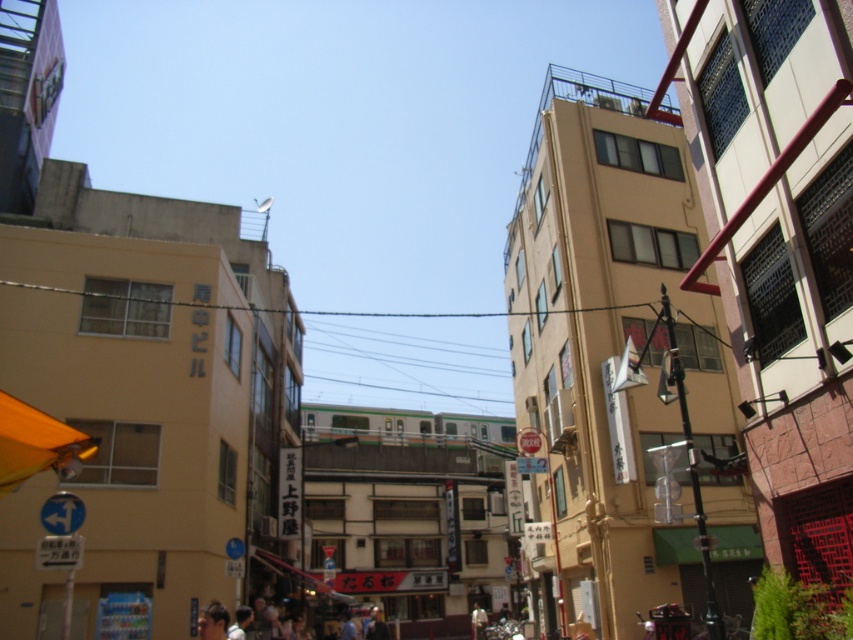
Question: Is matte black crowd at center smaller than smooth skin face at lower center?

Choices:
 (A) no
 (B) yes

Answer: (A)

Question: Which of the following is the farthest from the observer?

Choices:
 (A) matte black crowd at center
 (B) smooth skin face at lower center
 (C) clear wire at center
 (D) orange fabric umbrella at lower left

Answer: (C)

Question: Among these objects, which one is farthest from the camera?

Choices:
 (A) orange fabric umbrella at lower left
 (B) clear wire at center
 (C) smooth skin face at lower center
 (D) matte black crowd at center

Answer: (B)

Question: Is orange fabric umbrella at lower left above smooth skin face at lower center?

Choices:
 (A) yes
 (B) no

Answer: (A)

Question: Which is farther from the orange fabric umbrella at lower left?

Choices:
 (A) clear wire at center
 (B) smooth skin face at lower center

Answer: (A)

Question: Is orange fabric umbrella at lower left to the right of smooth skin face at lower center from the viewer's perspective?

Choices:
 (A) yes
 (B) no

Answer: (B)